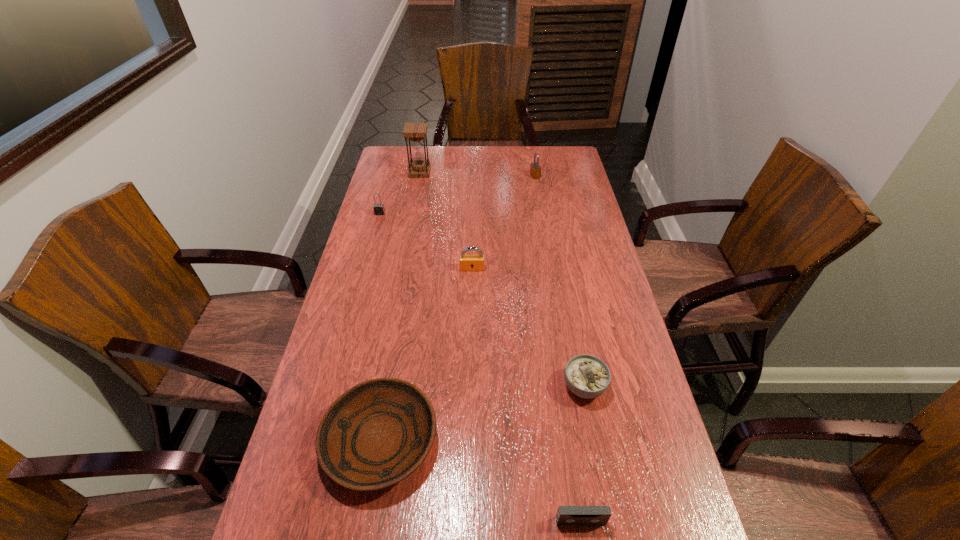
The width and height of the screenshot is (960, 540). Find the location of `the tallest object`. the tallest object is located at coordinates (416, 132).

At what (x,y) coordinates should I click in order to perform the action: click on the farthest padlock. Please return your answer as a coordinate pair (x, y). The width and height of the screenshot is (960, 540). Looking at the image, I should click on (535, 170).

What are the coordinates of `the nearest padlock` in the screenshot? It's located at (466, 262).

The width and height of the screenshot is (960, 540). I want to click on the fourth object from left to right, so click(x=466, y=262).

This screenshot has height=540, width=960. Identify the location of the second farthest padlock. (379, 209).

Where is `the third farthest object`? This screenshot has height=540, width=960. the third farthest object is located at coordinates (379, 209).

Where is `soup bowl`? This screenshot has height=540, width=960. soup bowl is located at coordinates (587, 376).

Where is `plate`? plate is located at coordinates (377, 433).

The width and height of the screenshot is (960, 540). In order to click on the nearest object in this screenshot , I will do `click(566, 515)`.

You are a GUI agent. You are given a task and a screenshot of the screen. Output one action in this format:
    pyautogui.click(x=<x>, y=<y>)
    Task: Click on the vacant space situated 0.060m on the front of the hourglass
    
    Given the screenshot: What is the action you would take?
    pyautogui.click(x=418, y=186)